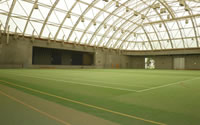
Where is `wall area closest to camera`? Image resolution: width=200 pixels, height=125 pixels. wall area closest to camera is located at coordinates tap(16, 55).